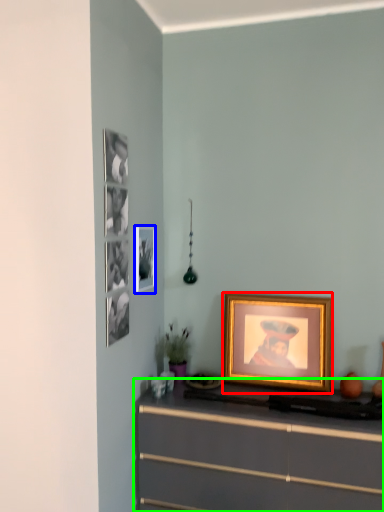
Question: Which object is the closest to the picture frame (highlighted by a red box)? Choose among these: picture frame (highlighted by a blue box) or chest of drawers (highlighted by a green box).

Choices:
 (A) picture frame
 (B) chest of drawers

Answer: (B)